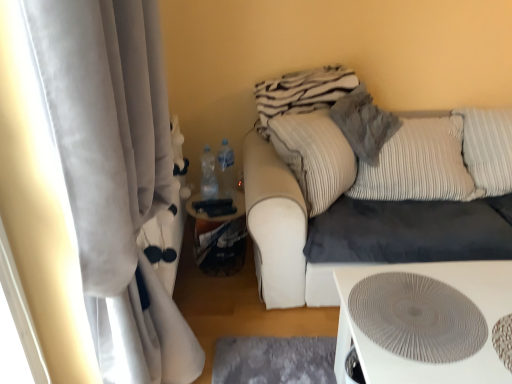
Question: From a real-world perspective, is velvet beige couch at center physically located above or below white velvet curtain at left?

Choices:
 (A) below
 (B) above

Answer: (A)

Question: Is velvet beige couch at center to the left or to the right of white velvet curtain at left in the image?

Choices:
 (A) right
 (B) left

Answer: (A)

Question: Estimate the real-world distances between objects in this image. Which object is closer to the white velvet curtain at left?

Choices:
 (A) white textured table at lower right
 (B) striped fabric pillow at upper right, acting as the second pillow starting from the left
 (C) velvet beige couch at center
 (D) textured gray pillow at upper right, the first pillow from the left

Answer: (A)

Question: Considering the real-world distances, which object is closest to the textured gray pillow at upper right, which is counted as the 2th pillow, starting from the right?

Choices:
 (A) white textured table at lower right
 (B) striped fabric pillow at upper right, the 1th pillow when ordered from right to left
 (C) white velvet curtain at left
 (D) velvet beige couch at center

Answer: (B)